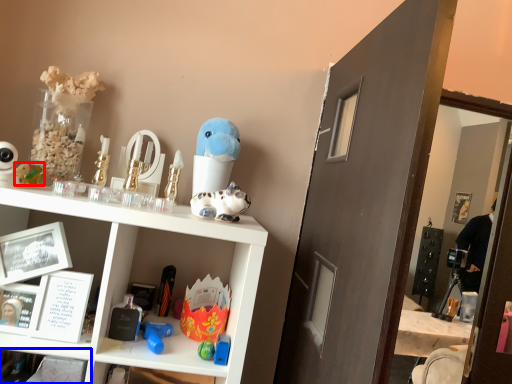
Question: Which of the following is the farthest to the observer, toy (highlighted by a red box) or shelf (highlighted by a blue box)?

Choices:
 (A) toy
 (B) shelf

Answer: (A)